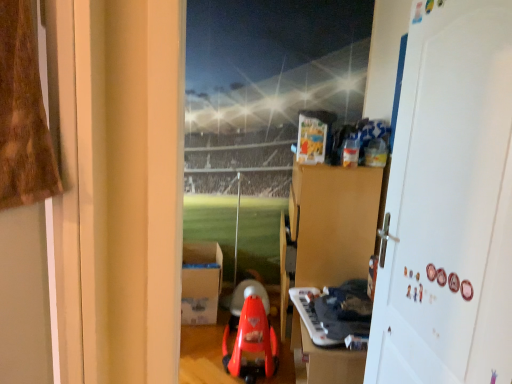
What do you see at coordinates (201, 282) in the screenshot? I see `white cardboard box at center` at bounding box center [201, 282].

How much space does rubberized red walker at center, the first toy when ordered from left to right, occupy vertically?

The height of rubberized red walker at center, the first toy when ordered from left to right, is 17.84 inches.

Find the location of a particular element. The image size is (512, 384). white plastic keyboard at lower center, which is the first toy from right to left is located at coordinates 311,315.

Between white matte door at right and brown cardboard dresser at upper center, which one appears on the left side from the viewer's perspective?

brown cardboard dresser at upper center.

Is white matte door at right next to brown cardboard dresser at upper center?

There is a gap between white matte door at right and brown cardboard dresser at upper center.

Does white matte door at right turn towards brown cardboard dresser at upper center?

No, white matte door at right does not turn towards brown cardboard dresser at upper center.

Can you confirm if white matte door at right is bigger than brown cardboard dresser at upper center?

Actually, white matte door at right might be smaller than brown cardboard dresser at upper center.

Is rubberized red walker at center, acting as the 2th toy starting from the right, in front of or behind white matte door at right in the image?

rubberized red walker at center, acting as the 2th toy starting from the right, is behind white matte door at right.

From the picture: Is rubberized red walker at center, the first toy when ordered from left to right, next to white matte door at right and touching it?

No, rubberized red walker at center, the first toy when ordered from left to right, is not in contact with white matte door at right.

From the image's perspective, which one is positioned higher, rubberized red walker at center, acting as the 2th toy starting from the right, or white matte door at right?

From the image's view, white matte door at right is above.

Is white matte door at right at the back of rubberized red walker at center, acting as the 2th toy starting from the right?

rubberized red walker at center, acting as the 2th toy starting from the right, does not have its back to white matte door at right.

From the image's perspective, which one is positioned higher, white plastic keyboard at lower center, the second toy when ordered from left to right, or white cardboard box at center?

From the image's view, white cardboard box at center is above.

Can you confirm if white plastic keyboard at lower center, the second toy when ordered from left to right, is smaller than white cardboard box at center?

Yes, white plastic keyboard at lower center, the second toy when ordered from left to right, is smaller than white cardboard box at center.

Relative to white cardboard box at center, is white plastic keyboard at lower center, the second toy when ordered from left to right, in front or behind?

Clearly, white plastic keyboard at lower center, the second toy when ordered from left to right, is in front of white cardboard box at center.

Would you say white plastic keyboard at lower center, the second toy when ordered from left to right, is inside or outside white cardboard box at center?

white plastic keyboard at lower center, the second toy when ordered from left to right, cannot be found inside white cardboard box at center.

Does rubberized red walker at center, the first toy when ordered from left to right, have a greater width compared to brown cardboard dresser at upper center?

Correct, the width of rubberized red walker at center, the first toy when ordered from left to right, exceeds that of brown cardboard dresser at upper center.

From a real-world perspective, is rubberized red walker at center, the first toy when ordered from left to right, positioned above or below brown cardboard dresser at upper center?

rubberized red walker at center, the first toy when ordered from left to right, is below brown cardboard dresser at upper center.

Is rubberized red walker at center, the first toy when ordered from left to right, taller or shorter than brown cardboard dresser at upper center?

Clearly, rubberized red walker at center, the first toy when ordered from left to right, is shorter compared to brown cardboard dresser at upper center.

Which of these two, rubberized red walker at center, acting as the 2th toy starting from the right, or brown cardboard dresser at upper center, is smaller?

Smaller between the two is rubberized red walker at center, acting as the 2th toy starting from the right.

Which object is positioned more to the right, brown cardboard dresser at upper center or white cardboard box at center?

From the viewer's perspective, brown cardboard dresser at upper center appears more on the right side.

Is brown cardboard dresser at upper center oriented towards white cardboard box at center?

Yes, brown cardboard dresser at upper center is facing white cardboard box at center.

From a real-world perspective, is brown cardboard dresser at upper center physically below white cardboard box at center?

Incorrect, from a real-world perspective, brown cardboard dresser at upper center is higher than white cardboard box at center.

Consider the image. From the image's perspective, which object appears higher, brown cardboard dresser at upper center or white cardboard box at center?

brown cardboard dresser at upper center is shown above in the image.

Between point (511, 344) and point (185, 294), which one is positioned behind?

Point (185, 294)

Based on the photo, from a real-world perspective, between white matte door at right and white cardboard box at center, who is vertically higher?

In real-world perspective, white matte door at right is above.

Is white matte door at right at the right side of white cardboard box at center?

Correct, you'll find white matte door at right to the right of white cardboard box at center.

Is white plastic keyboard at lower center, the second toy when ordered from left to right, positioned with its back to rubberized red walker at center, the first toy when ordered from left to right?

No, white plastic keyboard at lower center, the second toy when ordered from left to right, is not facing away from rubberized red walker at center, the first toy when ordered from left to right.

Does white plastic keyboard at lower center, which is the first toy from right to left, have a larger size compared to rubberized red walker at center, acting as the 2th toy starting from the right?

No.

From the image's perspective, would you say white plastic keyboard at lower center, the second toy when ordered from left to right, is positioned over rubberized red walker at center, the first toy when ordered from left to right?

Yes.

From the picture: Does white plastic keyboard at lower center, which is the first toy from right to left, come behind rubberized red walker at center, the first toy when ordered from left to right?

No, it is in front of rubberized red walker at center, the first toy when ordered from left to right.

I want to click on dresser below the white matte door at right (from a real-world perspective), so click(x=333, y=222).

What are the coordinates of `door above the rubberized red walker at center, the first toy when ordered from left to right (from the image's perspective)` in the screenshot? It's located at (449, 203).

Estimate the real-world distances between objects in this image. Which object is closer to brown cardboard dresser at upper center, white matte door at right or rubberized red walker at center, acting as the 2th toy starting from the right?

rubberized red walker at center, acting as the 2th toy starting from the right.

Which object lies further to the anchor point rubberized red walker at center, the first toy when ordered from left to right, white plastic keyboard at lower center, which is the first toy from right to left, or brown cardboard dresser at upper center?

The object further to rubberized red walker at center, the first toy when ordered from left to right, is brown cardboard dresser at upper center.

Looking at the image, which one is located further to white cardboard box at center, white matte door at right or brown cardboard dresser at upper center?

Based on the image, white matte door at right appears to be further to white cardboard box at center.

Which object lies nearer to the anchor point white matte door at right, white cardboard box at center or rubberized red walker at center, acting as the 2th toy starting from the right?

rubberized red walker at center, acting as the 2th toy starting from the right, is closer to white matte door at right.

Based on their spatial positions, is white cardboard box at center or brown cardboard dresser at upper center closer to white matte door at right?

Based on the image, brown cardboard dresser at upper center appears to be nearer to white matte door at right.

When comparing their distances from brown cardboard dresser at upper center, does white cardboard box at center or rubberized red walker at center, the first toy when ordered from left to right, seem further?

white cardboard box at center lies further to brown cardboard dresser at upper center than the other object.

Which object lies further to the anchor point brown cardboard dresser at upper center, white cardboard box at center or white matte door at right?

white cardboard box at center is positioned further to the anchor brown cardboard dresser at upper center.

Based on their spatial positions, is white plastic keyboard at lower center, the second toy when ordered from left to right, or white matte door at right closer to rubberized red walker at center, the first toy when ordered from left to right?

Based on the image, white plastic keyboard at lower center, the second toy when ordered from left to right, appears to be nearer to rubberized red walker at center, the first toy when ordered from left to right.

Locate an element on the screen. The height and width of the screenshot is (384, 512). toy located between rubberized red walker at center, acting as the 2th toy starting from the right, and brown cardboard dresser at upper center in the left-right direction is located at coordinates (311, 315).

You are a GUI agent. You are given a task and a screenshot of the screen. Output one action in this format:
    pyautogui.click(x=<x>, y=<y>)
    Task: Click on the toy between white matte door at right and rubberized red walker at center, the first toy when ordered from left to right, along the z-axis
    The width and height of the screenshot is (512, 384).
    Given the screenshot: What is the action you would take?
    click(x=311, y=315)

Locate an element on the screen. The image size is (512, 384). dresser between white matte door at right and white cardboard box at center along the z-axis is located at coordinates (333, 222).

Find the location of a particular element. This screenshot has width=512, height=384. toy between white cardboard box at center and white plastic keyboard at lower center, the second toy when ordered from left to right, in the horizontal direction is located at coordinates (251, 341).